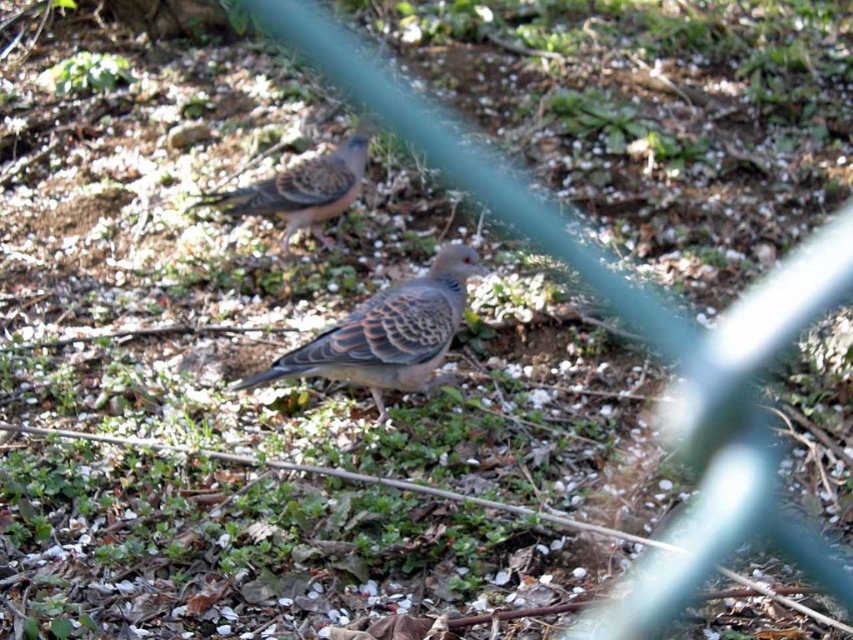
Question: Which object is closer to the camera taking this photo?

Choices:
 (A) speckled feathered pigeon at center
 (B) speckled feathered bird at center

Answer: (A)

Question: Which of the following is the farthest from the observer?

Choices:
 (A) speckled feathered bird at center
 (B) speckled feathered pigeon at center

Answer: (A)

Question: Does speckled feathered pigeon at center appear on the right side of speckled feathered bird at center?

Choices:
 (A) yes
 (B) no

Answer: (A)

Question: Is speckled feathered pigeon at center closer to the viewer compared to speckled feathered bird at center?

Choices:
 (A) no
 (B) yes

Answer: (B)

Question: Is speckled feathered pigeon at center below speckled feathered bird at center?

Choices:
 (A) yes
 (B) no

Answer: (A)